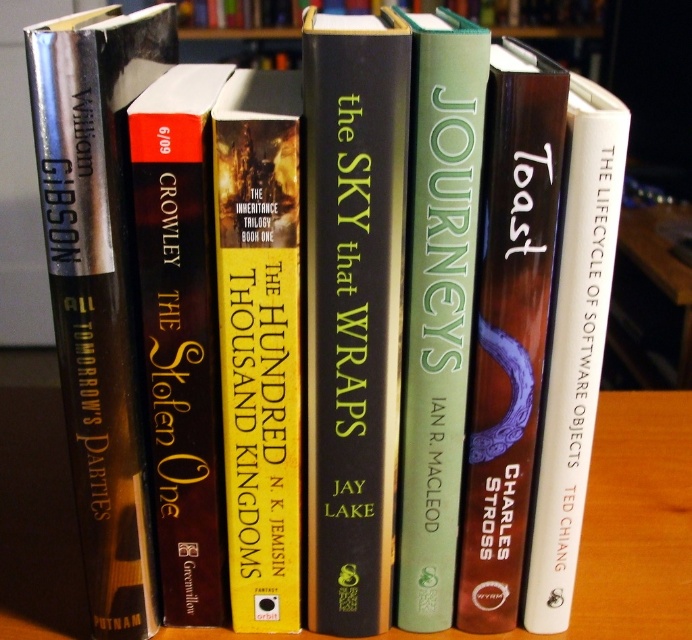
Does matte purple book at center appear on the left side of green matte book at center?

In fact, matte purple book at center is to the right of green matte book at center.

Can you confirm if matte purple book at center is positioned to the right of green matte book at center?

Correct, you'll find matte purple book at center to the right of green matte book at center.

Who is more forward, (528, 108) or (450, 544)?

Point (528, 108) is in front.

Where is `matte purple book at center`? The height and width of the screenshot is (640, 692). matte purple book at center is located at coordinates (509, 326).

Can you confirm if dark brown leather book at center is taller than white paper at center?

No, dark brown leather book at center is not taller than white paper at center.

Is dark brown leather book at center further to the viewer compared to white paper at center?

Yes, dark brown leather book at center is behind white paper at center.

Is point (179, 513) farther from camera compared to point (572, 492)?

Yes, point (179, 513) is farther from viewer.

Find the location of a particular element. dark brown leather book at center is located at coordinates (181, 333).

Measure the distance between point (x=689, y=433) and camera.

The distance of point (x=689, y=433) from camera is 3.31 feet.

Does wooden table at center have a lesser width compared to yellow hardcover book at center?

Incorrect, wooden table at center's width is not less than yellow hardcover book at center's.

Does point (30, 612) come farther from viewer compared to point (289, 80)?

No, it is not.

I want to click on wooden table at center, so click(630, 524).